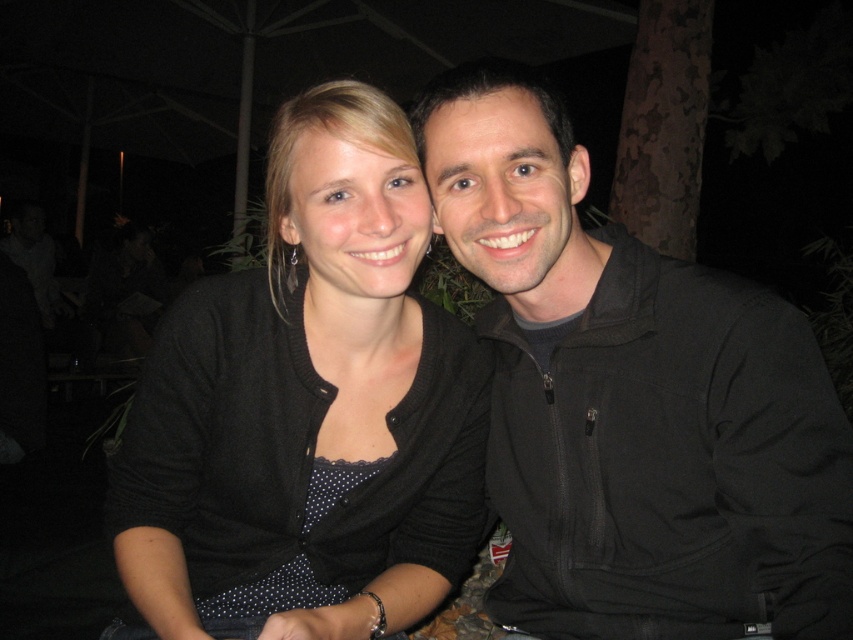
Is black softshell jacket at right closer to the viewer compared to black matte cardigan at center?

That is True.

Between black softshell jacket at right and black matte cardigan at center, which one has more height?

black softshell jacket at right

Is point (589, 625) less distant than point (198, 483)?

That is True.

You are a GUI agent. You are given a task and a screenshot of the screen. Output one action in this format:
    pyautogui.click(x=<x>, y=<y>)
    Task: Click on the black softshell jacket at right
    
    Given the screenshot: What is the action you would take?
    pyautogui.click(x=633, y=401)